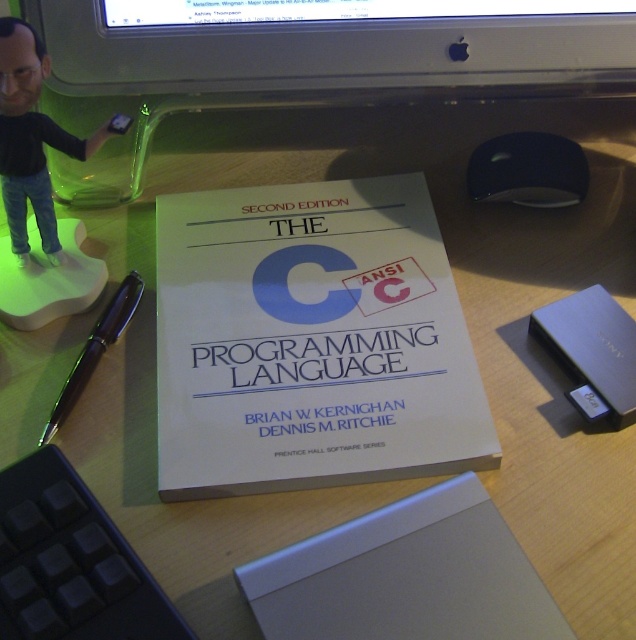
What is the 2D coordinate of the black glossy mouse at upper right?

The black glossy mouse at upper right is located at the 2D coordinate point of (529, 170).

You are organizing items on the desk and need to place the black plastic figurine at upper left and the black glossy pen at left in a specific order. Which item is located to the left of the other?

The black plastic figurine at upper left is positioned on the left side of black glossy pen at left.

You are a person with a 6.5 inch wide notebook. You want to place it between the silver plastic computer monitor at upper center and the black glossy mouse at upper right. Can it fit?

The distance between the silver plastic computer monitor at upper center and the black glossy mouse at upper right is 7.17 inches. Since the notebook is 6.5 inches wide, it can fit in the space between them.